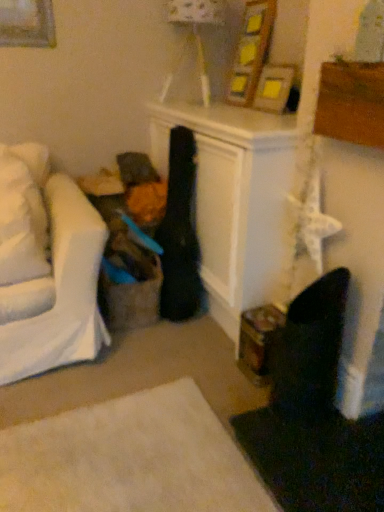
Question: Would you say wooden picture frame at upper center is a long distance from white soft pillow at left?

Choices:
 (A) no
 (B) yes

Answer: (B)

Question: Is wooden picture frame at upper center smaller than white soft pillow at left?

Choices:
 (A) yes
 (B) no

Answer: (A)

Question: Is wooden picture frame at upper center shorter than white soft pillow at left?

Choices:
 (A) yes
 (B) no

Answer: (A)

Question: Does wooden picture frame at upper center come in front of white soft pillow at left?

Choices:
 (A) no
 (B) yes

Answer: (A)

Question: Is wooden picture frame at upper center aimed at white soft pillow at left?

Choices:
 (A) yes
 (B) no

Answer: (A)

Question: Does point (46, 243) appear closer or farther from the camera than point (195, 6)?

Choices:
 (A) closer
 (B) farther

Answer: (A)

Question: From the image's perspective, relative to matte white lampshade at upper center, is white soft pillow at left above or below?

Choices:
 (A) below
 (B) above

Answer: (A)

Question: In terms of height, does white soft pillow at left look taller or shorter compared to matte white lampshade at upper center?

Choices:
 (A) tall
 (B) short

Answer: (B)

Question: Is white soft pillow at left inside or outside of matte white lampshade at upper center?

Choices:
 (A) outside
 (B) inside

Answer: (A)

Question: Is wooden picture frame at upper center wider or thinner than matte white lampshade at upper center?

Choices:
 (A) thin
 (B) wide

Answer: (A)

Question: Does point (284, 87) appear closer or farther from the camera than point (200, 70)?

Choices:
 (A) closer
 (B) farther

Answer: (A)

Question: Is wooden picture frame at upper center in front of or behind matte white lampshade at upper center in the image?

Choices:
 (A) front
 (B) behind

Answer: (A)

Question: In terms of size, does wooden picture frame at upper center appear bigger or smaller than matte white lampshade at upper center?

Choices:
 (A) small
 (B) big

Answer: (A)

Question: Is point (268, 74) closer or farther from the camera than point (8, 221)?

Choices:
 (A) farther
 (B) closer

Answer: (A)

Question: Is wooden picture frame at upper center bigger or smaller than white soft pillow at left?

Choices:
 (A) small
 (B) big

Answer: (A)